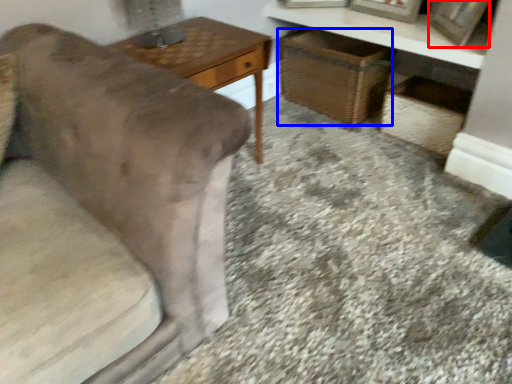
Question: Among these objects, which one is nearest to the camera, picture frame (highlighted by a red box) or basket (highlighted by a blue box)?

Choices:
 (A) picture frame
 (B) basket

Answer: (A)